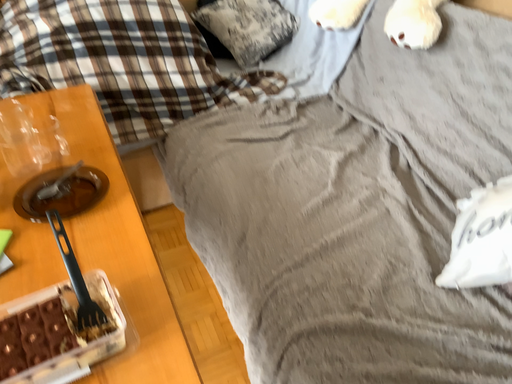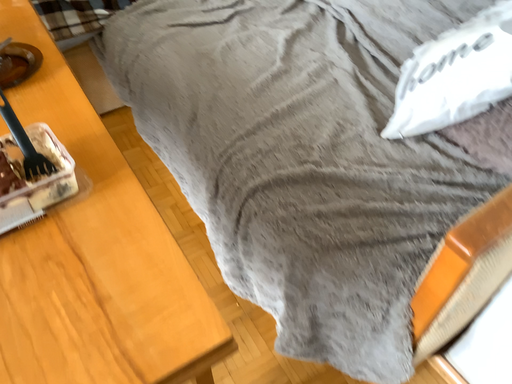
Question: Which way did the camera rotate in the video?

Choices:
 (A) rotated upward
 (B) rotated downward

Answer: (B)